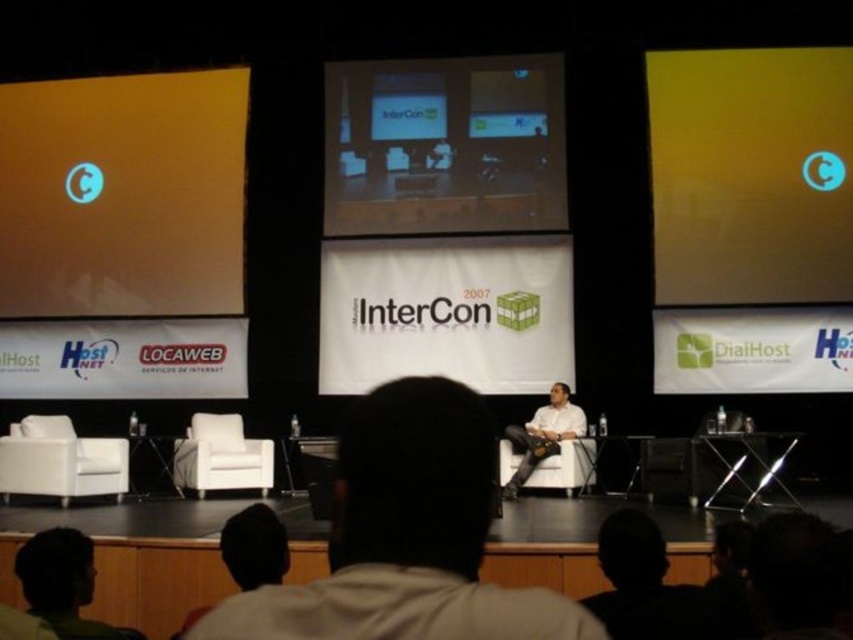
You are setting up for the InterCon 2007 event and need to place both the matte black monitor at center and the light brown leather jacket at center on the stage. Given that the stage has limited space, can you determine which object requires more horizontal space?

The matte black monitor at center might be wider than the light brown leather jacket at center, so it likely requires more horizontal space.

You are standing in the audience looking at the stage during the InterCon 2007 event. There is a point marked at coordinates [751,176]. Which object on the stage does this point correspond to?

The point at coordinates [751,176] corresponds to the yellow matte screen at upper right.

In the scene shown: You are attending InterCon 2007 and need to present your slides. The projector is set up to display on the orange matte projection screen at left and the green fabric head at lower left. Which object should you use for your presentation slides?

The orange matte projection screen at left is taller than the green fabric head at lower left, so you should use the orange matte projection screen at left for your presentation slides because it is larger and more suitable for displaying content.